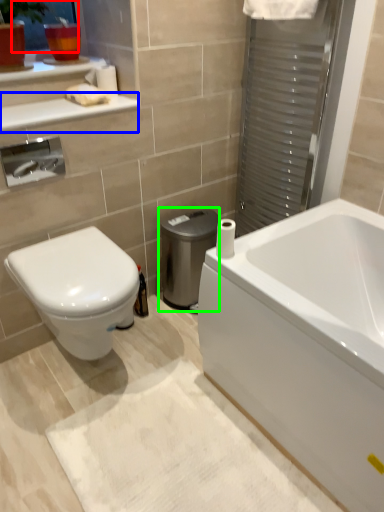
Question: Which object is positioned closest to window screen (highlighted by a red box)? Select from balustrade (highlighted by a blue box) and water heater (highlighted by a green box).

Choices:
 (A) balustrade
 (B) water heater

Answer: (A)